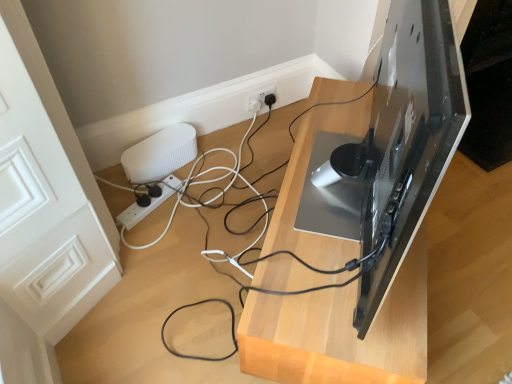
This screenshot has width=512, height=384. Find the location of `vacant area on the back side of white plastic power strip at lower center`. vacant area on the back side of white plastic power strip at lower center is located at coordinates (175, 175).